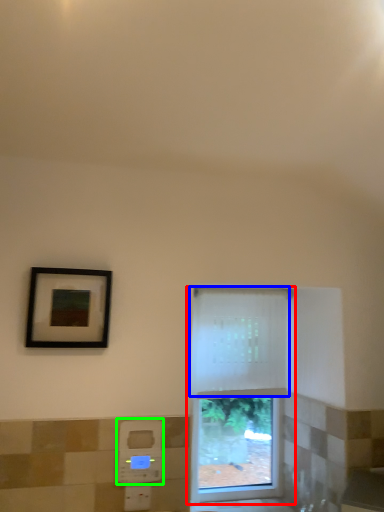
Question: Estimate the real-world distances between objects in this image. Which object is closer to window (highlighted by a red box), curtain (highlighted by a blue box) or hand dryer (highlighted by a green box)?

Choices:
 (A) curtain
 (B) hand dryer

Answer: (A)